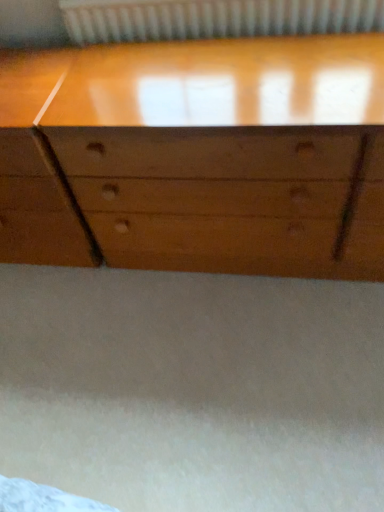
At what (x,y) coordinates should I click in order to perform the action: click on wooden chest of drawers at center. Please return your answer as a coordinate pair (x, y). Looking at the image, I should click on (200, 159).

Describe the element at coordinates (200, 159) in the screenshot. The width and height of the screenshot is (384, 512). I see `wooden chest of drawers at center` at that location.

What is the approximate height of wooden chest of drawers at center?

25.82 inches.

At what (x,y) coordinates should I click in order to perform the action: click on wooden chest of drawers at center. Please return your answer as a coordinate pair (x, y). The width and height of the screenshot is (384, 512). Looking at the image, I should click on (200, 159).